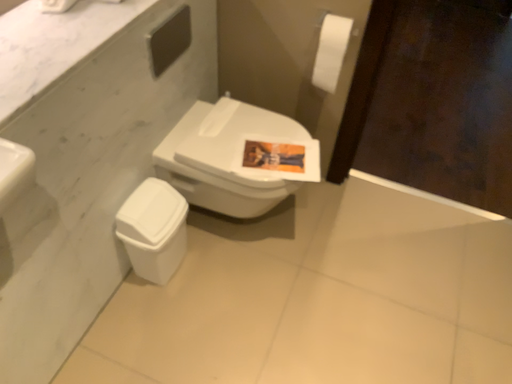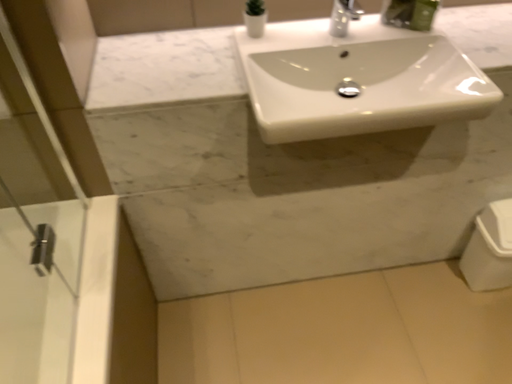
Question: Which way did the camera rotate in the video?

Choices:
 (A) rotated right
 (B) rotated left

Answer: (B)